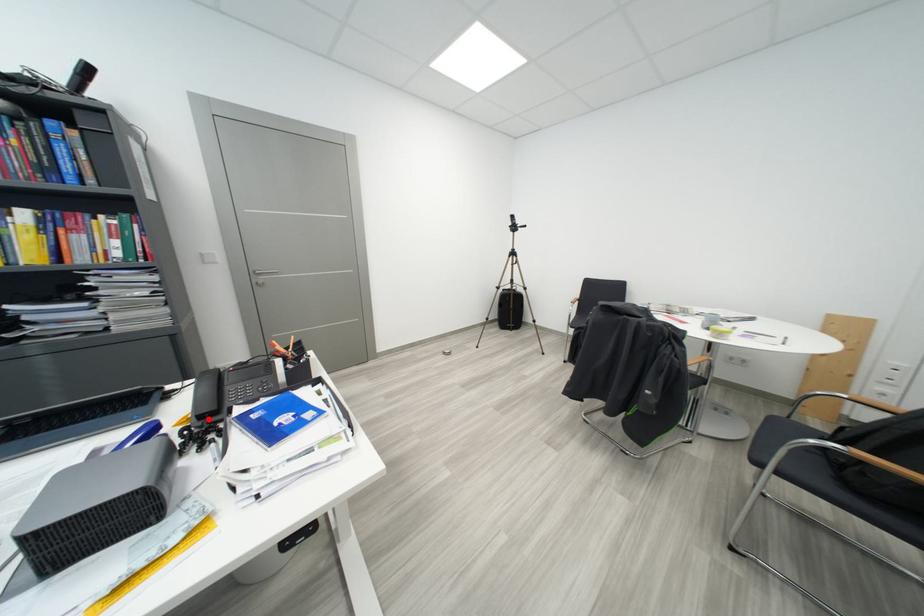
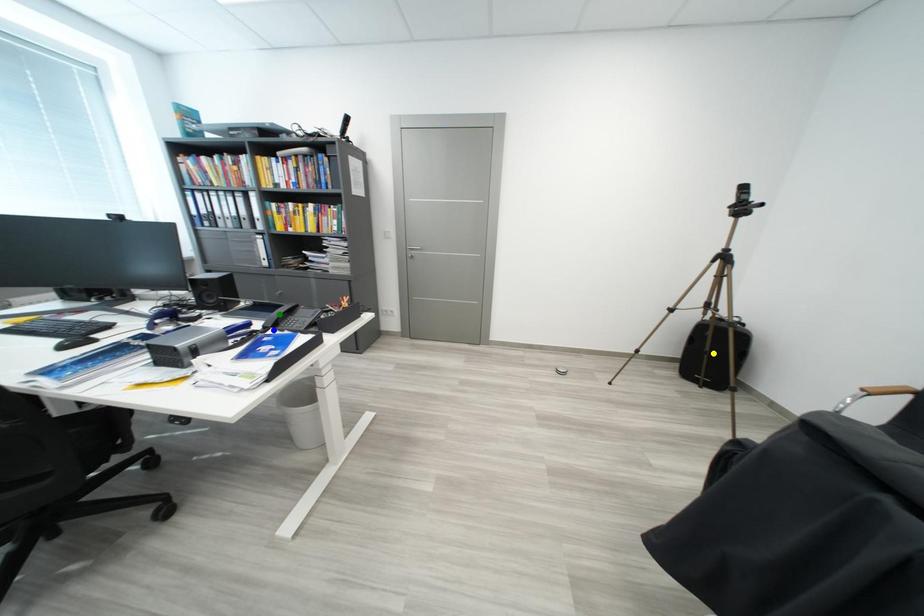
Question: I am providing you with two images of the same scene from different viewpoints. A red point is marked on the first image. You are given multiple points on the second image. Which point in image 2 represents the same 3d spot as the red point in image 1?

Choices:
 (A) blue point
 (B) yellow point
 (C) green point

Answer: (A)